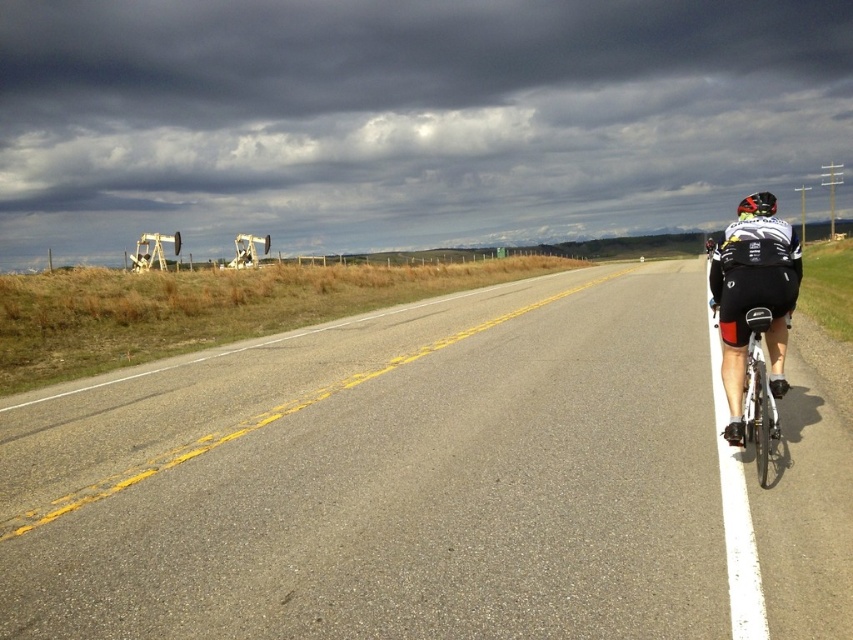
Question: Which object appears farthest from the camera in this image?

Choices:
 (A) asphalt road at center
 (B) shiny black helmet at right

Answer: (B)

Question: Which point appears closest to the camera in this image?

Choices:
 (A) (404, 538)
 (B) (740, 214)

Answer: (A)

Question: Which point appears farthest from the camera in this image?

Choices:
 (A) (738, 360)
 (B) (757, 326)
 (C) (376, 333)

Answer: (C)

Question: Where is black matte cycling jersey at right located in relation to shiny black helmet at right in the image?

Choices:
 (A) right
 (B) left

Answer: (B)

Question: Is asphalt road at center below black matte cycling jersey at right?

Choices:
 (A) no
 (B) yes

Answer: (B)

Question: Is white metallic bicycle at right further to camera compared to shiny black helmet at right?

Choices:
 (A) yes
 (B) no

Answer: (B)